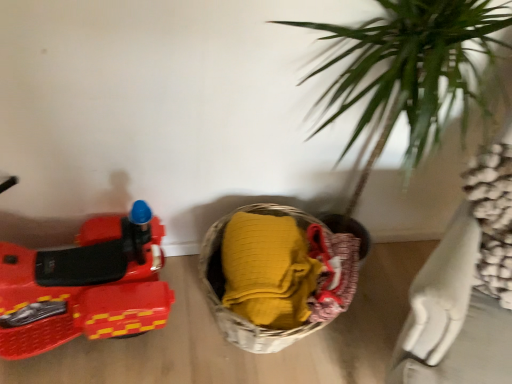
Question: Considering their positions, is shiny plastic toy car at left located in front of or behind woven fabric basket at lower center?

Choices:
 (A) front
 (B) behind

Answer: (A)

Question: Is shiny plastic toy car at left spatially inside woven fabric basket at lower center, or outside of it?

Choices:
 (A) outside
 (B) inside

Answer: (A)

Question: Does point (124, 284) appear closer or farther from the camera than point (286, 302)?

Choices:
 (A) closer
 (B) farther

Answer: (B)

Question: Is woven fabric basket at lower center taller or shorter than shiny plastic toy car at left?

Choices:
 (A) short
 (B) tall

Answer: (A)

Question: Looking at the image, does woven fabric basket at lower center seem bigger or smaller compared to shiny plastic toy car at left?

Choices:
 (A) small
 (B) big

Answer: (A)

Question: From the image's perspective, is woven fabric basket at lower center located above or below shiny plastic toy car at left?

Choices:
 (A) above
 (B) below

Answer: (B)

Question: Considering their positions, is woven fabric basket at lower center located in front of or behind shiny plastic toy car at left?

Choices:
 (A) behind
 (B) front

Answer: (A)